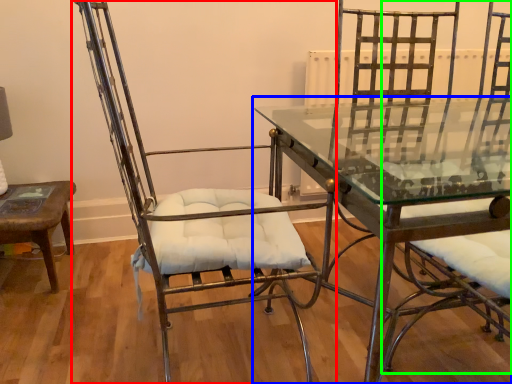
Question: Based on their relative distances, which object is nearer to chair (highlighted by a red box)? Choose from table (highlighted by a blue box) and swivel chair (highlighted by a green box).

Choices:
 (A) table
 (B) swivel chair

Answer: (A)